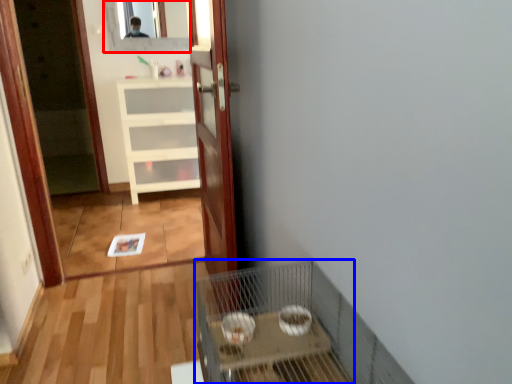
Question: Which point is further to the camera, mirror (highlighted by a red box) or cage (highlighted by a blue box)?

Choices:
 (A) mirror
 (B) cage

Answer: (A)